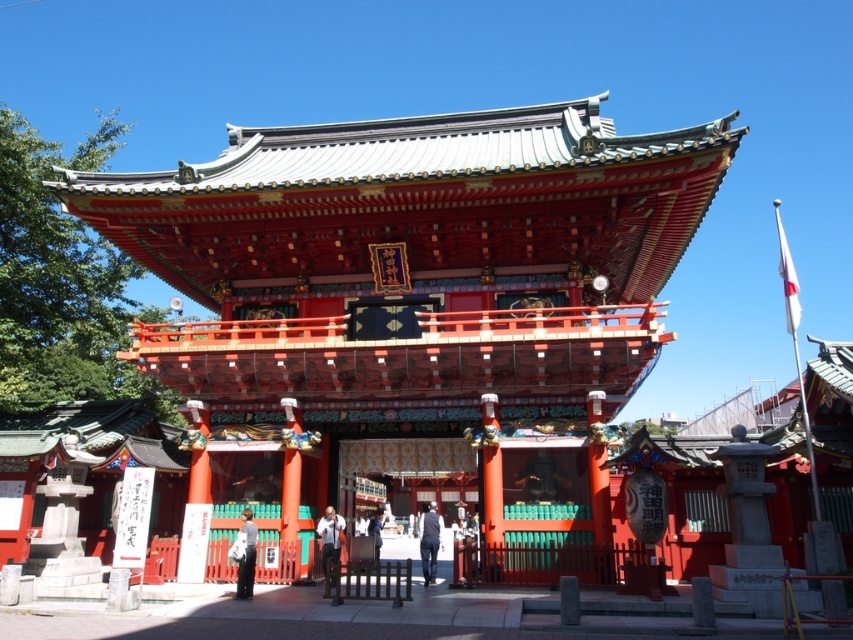
Can you confirm if shiny lacquered shrine gate at center is thinner than blue fabric at center?

In fact, shiny lacquered shrine gate at center might be wider than blue fabric at center.

Is shiny lacquered shrine gate at center wider than blue fabric at center?

Indeed, shiny lacquered shrine gate at center has a greater width compared to blue fabric at center.

You are a GUI agent. You are given a task and a screenshot of the screen. Output one action in this format:
    pyautogui.click(x=<x>, y=<y>)
    Task: Click on the shiny lacquered shrine gate at center
    
    Given the screenshot: What is the action you would take?
    pyautogui.click(x=415, y=300)

Is shiny lacquered shrine gate at center behind white matte shirt at lower center?

No, it is in front of white matte shirt at lower center.

Is shiny lacquered shrine gate at center taller than white matte shirt at lower center?

Correct, shiny lacquered shrine gate at center is much taller as white matte shirt at lower center.

The width and height of the screenshot is (853, 640). In order to click on shiny lacquered shrine gate at center in this screenshot , I will do `click(415, 300)`.

Is white shirt at center positioned in front of blue fabric at center?

Yes, white shirt at center is in front of blue fabric at center.

In the scene shown: Which of these two, white shirt at center or blue fabric at center, stands taller?

Standing taller between the two is blue fabric at center.

Is point (339, 545) behind point (370, 532)?

No.

You are a GUI agent. You are given a task and a screenshot of the screen. Output one action in this format:
    pyautogui.click(x=<x>, y=<y>)
    Task: Click on the white shirt at center
    
    Given the screenshot: What is the action you would take?
    pyautogui.click(x=329, y=541)